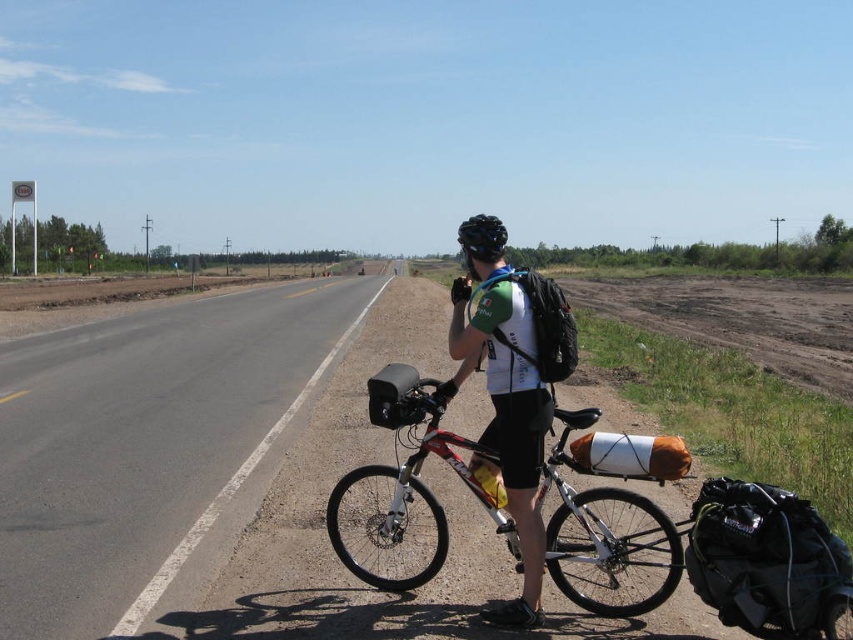
Can you confirm if asphalt road at left is shorter than black matte bicycle helmet at center?

Incorrect, asphalt road at left's height does not fall short of black matte bicycle helmet at center's.

Does asphalt road at left appear over black matte bicycle helmet at center?

No, asphalt road at left is not above black matte bicycle helmet at center.

Between point (45, 486) and point (467, 228), which one is positioned in front?

Positioned in front is point (467, 228).

The image size is (853, 640). Identify the location of asphalt road at left. (149, 445).

Who is taller, asphalt road at left or white fabric shirt at center?

asphalt road at left is taller.

Who is more forward, (264, 428) or (541, 285)?

Positioned in front is point (541, 285).

Between point (204, 554) and point (529, 586), which one is positioned behind?

The point (204, 554) is behind.

The width and height of the screenshot is (853, 640). What are the coordinates of `asphalt road at left` in the screenshot? It's located at (149, 445).

Is white fabric shirt at center shorter than black matte bicycle helmet at center?

No.

Is white fabric shirt at center positioned before black matte bicycle helmet at center?

That is True.

Measure the distance between point (x=500, y=620) and camera.

The distance of point (x=500, y=620) from camera is 13.57 feet.

Where is `white fabric shirt at center`? The width and height of the screenshot is (853, 640). white fabric shirt at center is located at coordinates (512, 396).